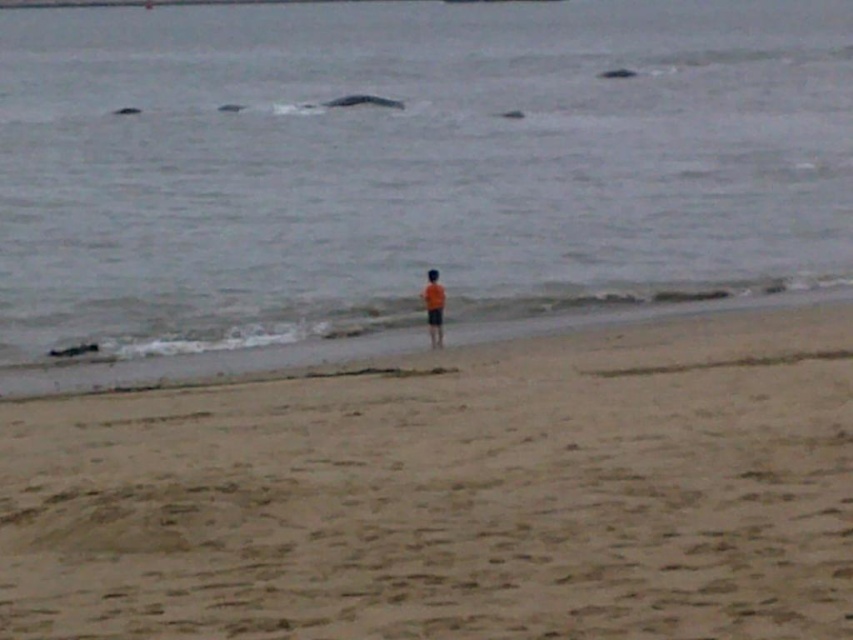
Is gray matte water at center to the right of orange fabric person at center from the viewer's perspective?

In fact, gray matte water at center is to the left of orange fabric person at center.

Can you confirm if gray matte water at center is taller than orange fabric person at center?

Yes.

Identify the location of gray matte water at center. (409, 168).

Who is higher up, gray matte water at center or light brown sand at center?

gray matte water at center is above.

Which of these two, gray matte water at center or light brown sand at center, stands shorter?

With less height is light brown sand at center.

I want to click on gray matte water at center, so click(409, 168).

Which is in front, point (474, 560) or point (434, 332)?

Point (474, 560) is more forward.

Can you confirm if light brown sand at center is smaller than orange fabric person at center?

Incorrect, light brown sand at center is not smaller in size than orange fabric person at center.

Where is `light brown sand at center`? light brown sand at center is located at coordinates (453, 496).